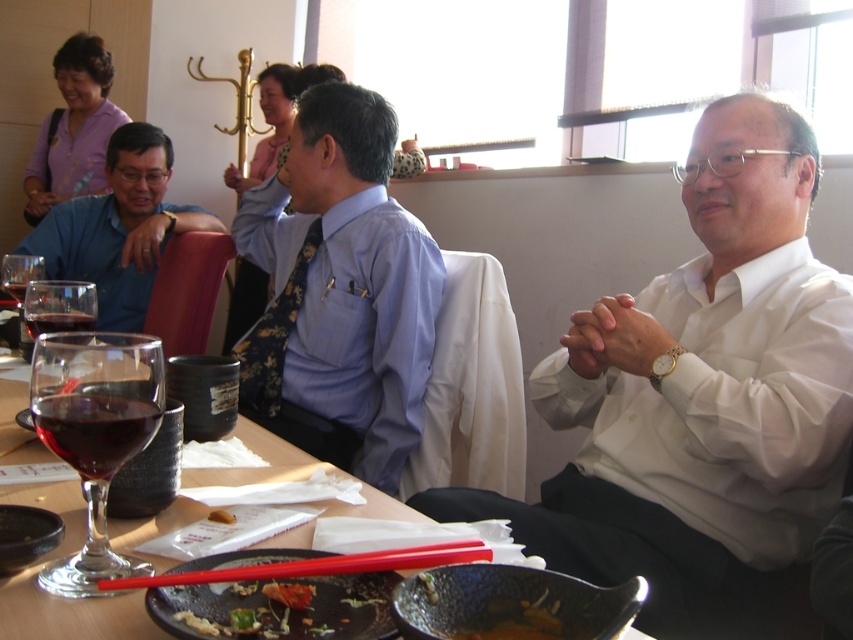
You are a waiter at a restaurant and need to place a new wine glass on the table. The existing transparent glass wine at table left is located at point (x=20, y=280). Where should you place the new glass to avoid placing it directly on top of the existing one?

Place the new wine glass away from point (x=20, y=280) to avoid overlapping with the existing transparent glass wine at table left.

You are a server at a restaurant. You need to place a new menu on the table between the transparent glass wine glass at center and the white paper at center. The menu is 3 inches wide. Is there enough space between them to fit the menu?

The transparent glass wine glass at center is 7.42 inches from the white paper at center. Since the menu is 3 inches wide, there is enough space between them to fit the menu.